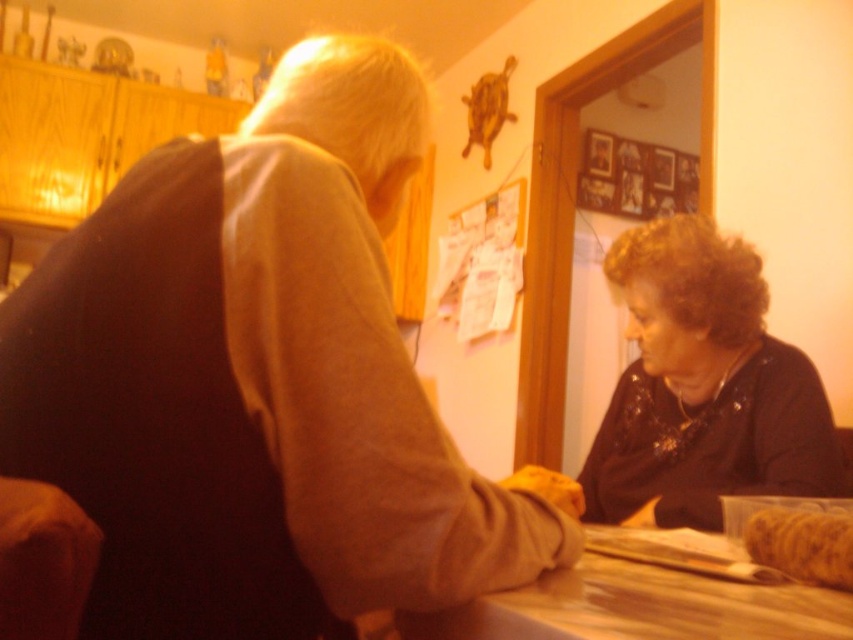
Is brown matte sweater at upper left closer to the viewer compared to yellow fluffy bread at lower right?

Yes, brown matte sweater at upper left is in front of yellow fluffy bread at lower right.

Does point (196, 579) lie behind point (816, 518)?

No, (196, 579) is closer to viewer.

Does point (379, 348) lie in front of point (811, 573)?

Yes, point (379, 348) is closer to viewer.

I want to click on brown matte sweater at upper left, so click(260, 380).

Does brown matte sweater at upper left appear on the right side of wooden at center?

No, brown matte sweater at upper left is not to the right of wooden at center.

Which of these two, brown matte sweater at upper left or wooden at center, stands shorter?

Standing shorter between the two is wooden at center.

The width and height of the screenshot is (853, 640). Identify the location of brown matte sweater at upper left. (260, 380).

Can you confirm if dark brown sweater at lower right is shorter than yellow fluffy bread at lower right?

No, dark brown sweater at lower right is not shorter than yellow fluffy bread at lower right.

Can you confirm if dark brown sweater at lower right is wider than yellow fluffy bread at lower right?

Yes, dark brown sweater at lower right is wider than yellow fluffy bread at lower right.

Locate an element on the screen. dark brown sweater at lower right is located at coordinates (701, 387).

Locate an element on the screen. The height and width of the screenshot is (640, 853). dark brown sweater at lower right is located at coordinates (701, 387).